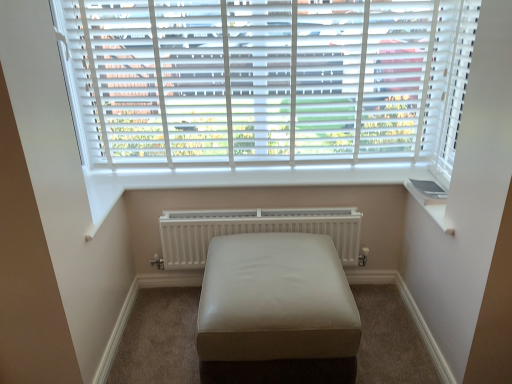
Measure the distance between point [222,242] and camera.

A distance of 1.89 meters exists between point [222,242] and camera.

Identify the location of white matte blinds at upper center. (267, 81).

The image size is (512, 384). What do you see at coordinates (267, 81) in the screenshot?
I see `white matte blinds at upper center` at bounding box center [267, 81].

Image resolution: width=512 pixels, height=384 pixels. I want to click on white matte radiator at center, so click(253, 230).

Does white matte blinds at upper center touch white matte radiator at center?

white matte blinds at upper center and white matte radiator at center are not in contact.

Looking at this image, can you confirm if white matte blinds at upper center is shorter than white matte radiator at center?

No.

From the image's perspective, is white matte blinds at upper center above white matte radiator at center?

Correct, white matte blinds at upper center appears higher than white matte radiator at center in the image.

Where is `radiator that is below the white matte blinds at upper center (from the image's perspective)`? radiator that is below the white matte blinds at upper center (from the image's perspective) is located at coordinates (253, 230).

From the image's perspective, which is below, white matte blinds at upper center or beige leather ottoman at center?

From the image's view, beige leather ottoman at center is below.

From a real-world perspective, who is located lower, white matte blinds at upper center or beige leather ottoman at center?

From a 3D spatial view, beige leather ottoman at center is below.

Could you tell me if white matte blinds at upper center is turned towards beige leather ottoman at center?

No, white matte blinds at upper center is not turned towards beige leather ottoman at center.

Is beige leather ottoman at center far from white matte blinds at upper center?

No, beige leather ottoman at center is in close proximity to white matte blinds at upper center.

From the image's perspective, between beige leather ottoman at center and white matte blinds at upper center, which one is located above?

From the image's view, white matte blinds at upper center is above.

The width and height of the screenshot is (512, 384). I want to click on furniture that is in front of the white matte blinds at upper center, so click(276, 312).

Which object is wider, beige leather ottoman at center or white matte blinds at upper center?

Wider between the two is beige leather ottoman at center.

Based on the photo, is white matte radiator at center turned away from white matte blinds at upper center?

No, white matte radiator at center is not facing away from white matte blinds at upper center.

Can you confirm if white matte radiator at center is shorter than white matte blinds at upper center?

Correct, white matte radiator at center is not as tall as white matte blinds at upper center.

Is white matte blinds at upper center surrounded by white matte radiator at center?

Actually, white matte blinds at upper center is outside white matte radiator at center.

Looking at their sizes, would you say white matte radiator at center is wider or thinner than white matte blinds at upper center?

white matte radiator at center is wider than white matte blinds at upper center.

Where is `radiator on the left of the beige leather ottoman at center`? radiator on the left of the beige leather ottoman at center is located at coordinates (253, 230).

Is white matte radiator at center at the left side of beige leather ottoman at center?

Indeed, white matte radiator at center is positioned on the left side of beige leather ottoman at center.

Which of these two, white matte radiator at center or beige leather ottoman at center, stands taller?

Standing taller between the two is beige leather ottoman at center.

Is the depth of white matte radiator at center less than that of beige leather ottoman at center?

No, white matte radiator at center is further to the viewer.

Between beige leather ottoman at center and white matte radiator at center, which one has smaller width?

white matte radiator at center.

From a real-world perspective, is beige leather ottoman at center located higher than white matte radiator at center?

No, from a real-world perspective, beige leather ottoman at center is not on top of white matte radiator at center.

Between beige leather ottoman at center and white matte radiator at center, which one has less height?

white matte radiator at center.

Is beige leather ottoman at center positioned beyond the bounds of white matte radiator at center?

Yes.

At what (x,y) coordinates should I click in order to perform the action: click on window blind located in front of the white matte radiator at center. Please return your answer as a coordinate pair (x, y). The image size is (512, 384). Looking at the image, I should click on [x=267, y=81].

At what (x,y) coordinates should I click in order to perform the action: click on window blind behind the beige leather ottoman at center. Please return your answer as a coordinate pair (x, y). This screenshot has height=384, width=512. Looking at the image, I should click on (267, 81).

Which object lies further to the anchor point beige leather ottoman at center, white matte blinds at upper center or white matte radiator at center?

The object further to beige leather ottoman at center is white matte blinds at upper center.

Based on their spatial positions, is white matte radiator at center or white matte blinds at upper center further from beige leather ottoman at center?

white matte blinds at upper center is further to beige leather ottoman at center.

Consider the image. From the image, which object appears to be nearer to white matte radiator at center, beige leather ottoman at center or white matte blinds at upper center?

beige leather ottoman at center is positioned closer to the anchor white matte radiator at center.

Based on their spatial positions, is beige leather ottoman at center or white matte radiator at center closer to white matte blinds at upper center?

white matte radiator at center.

Considering their positions, is white matte blinds at upper center positioned closer to white matte radiator at center than beige leather ottoman at center?

beige leather ottoman at center.

Estimate the real-world distances between objects in this image. Which object is closer to white matte blinds at upper center, white matte radiator at center or beige leather ottoman at center?

white matte radiator at center is positioned closer to the anchor white matte blinds at upper center.

I want to click on radiator between white matte blinds at upper center and beige leather ottoman at center vertically, so (253, 230).